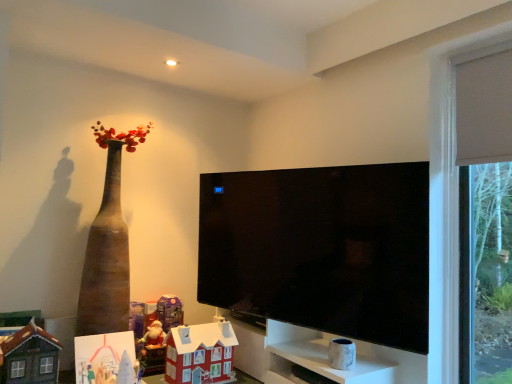
Where is `black glossy tv at center`? This screenshot has width=512, height=384. black glossy tv at center is located at coordinates (321, 249).

What do you see at coordinates (200, 354) in the screenshot?
I see `cardboard house at center, positioned as the second toy in right-to-left order` at bounding box center [200, 354].

Identify the location of white marble vase at lower center, which is counted as the 6th toy, starting from the left. (342, 354).

The width and height of the screenshot is (512, 384). In order to click on window above the matte purple toy at lower center, which is counted as the third toy, starting from the right (from the image's perspective) in this screenshot , I will do `click(448, 195)`.

Is point (435, 62) closer or farther from the camera than point (175, 301)?

Point (435, 62).

From the image's perspective, is matte white curtain at right over matte purple toy at lower center, the fourth toy in the left-to-right sequence?

Correct, matte white curtain at right appears higher than matte purple toy at lower center, the fourth toy in the left-to-right sequence, in the image.

Which is correct: white marble vase at lower center, which ranks as the first toy in right-to-left order, is inside matte brown house at lower left, the 1th toy in the left-to-right sequence, or outside of it?

white marble vase at lower center, which ranks as the first toy in right-to-left order, cannot be found inside matte brown house at lower left, the 1th toy in the left-to-right sequence.

Considering the sizes of objects white marble vase at lower center, which ranks as the first toy in right-to-left order, and matte brown house at lower left, the 1th toy in the left-to-right sequence, in the image provided, who is thinner, white marble vase at lower center, which ranks as the first toy in right-to-left order, or matte brown house at lower left, the 1th toy in the left-to-right sequence,?

white marble vase at lower center, which ranks as the first toy in right-to-left order.

In the image, is white marble vase at lower center, which ranks as the first toy in right-to-left order, on the left side or the right side of matte brown house at lower left, the 1th toy in the left-to-right sequence?

Clearly, white marble vase at lower center, which ranks as the first toy in right-to-left order, is on the right of matte brown house at lower left, the 1th toy in the left-to-right sequence, in the image.

Is white marble vase at lower center, which ranks as the first toy in right-to-left order, next to matte brown house at lower left, the 1th toy in the left-to-right sequence?

No, white marble vase at lower center, which ranks as the first toy in right-to-left order, is not touching matte brown house at lower left, the 1th toy in the left-to-right sequence.

Looking at this image, would you say matte white curtain at right is part of matte brown house at lower left, the 1th toy in the left-to-right sequence,'s contents?

That's incorrect, matte white curtain at right is not inside matte brown house at lower left, the 1th toy in the left-to-right sequence.

Is matte brown house at lower left, the sixth toy in the right-to-left sequence, at the right side of matte white curtain at right?

No.

Does matte brown house at lower left, the 1th toy in the left-to-right sequence, turn towards matte white curtain at right?

No, matte brown house at lower left, the 1th toy in the left-to-right sequence, is not oriented towards matte white curtain at right.

Which is closer to the camera, (150, 335) or (351, 353)?

Clearly, point (150, 335) is more distant from the camera than point (351, 353).

Is matte plastic santa at lower left, which is counted as the 3th toy, starting from the left, positioned far away from white marble vase at lower center, which ranks as the first toy in right-to-left order?

Yes.

Between matte plastic santa at lower left, positioned as the 4th toy in right-to-left order, and white marble vase at lower center, which ranks as the first toy in right-to-left order, which one has larger size?

With larger size is matte plastic santa at lower left, positioned as the 4th toy in right-to-left order.

How different are the orientations of matte plastic santa at lower left, positioned as the 4th toy in right-to-left order, and white marble vase at lower center, which ranks as the first toy in right-to-left order, in degrees?

85.9 degrees separate the facing orientations of matte plastic santa at lower left, positioned as the 4th toy in right-to-left order, and white marble vase at lower center, which ranks as the first toy in right-to-left order.

From a real-world perspective, is matte purple toy at lower center, the fourth toy in the left-to-right sequence, located beneath white marble cabinet at lower right?

Incorrect, from a real-world perspective, matte purple toy at lower center, the fourth toy in the left-to-right sequence, is higher than white marble cabinet at lower right.

Considering the sizes of matte purple toy at lower center, the fourth toy in the left-to-right sequence, and white marble cabinet at lower right in the image, is matte purple toy at lower center, the fourth toy in the left-to-right sequence, taller or shorter than white marble cabinet at lower right?

In the image, matte purple toy at lower center, the fourth toy in the left-to-right sequence, appears to be taller than white marble cabinet at lower right.

Which is correct: matte purple toy at lower center, which is counted as the third toy, starting from the right, is inside white marble cabinet at lower right, or outside of it?

matte purple toy at lower center, which is counted as the third toy, starting from the right, is spatially situated outside white marble cabinet at lower right.

Considering the positions of objects matte purple toy at lower center, which is counted as the third toy, starting from the right, and white marble cabinet at lower right in the image provided, who is behind, matte purple toy at lower center, which is counted as the third toy, starting from the right, or white marble cabinet at lower right?

matte purple toy at lower center, which is counted as the third toy, starting from the right, is further away from the camera.

Is matte white curtain at right aimed at matte brown house at lower left, the 1th toy in the left-to-right sequence?

No, matte white curtain at right does not turn towards matte brown house at lower left, the 1th toy in the left-to-right sequence.

Consider the image. Would you say matte white curtain at right is to the left or to the right of matte brown house at lower left, the sixth toy in the right-to-left sequence, in the picture?

Based on their positions, matte white curtain at right is located to the right of matte brown house at lower left, the sixth toy in the right-to-left sequence.

Is matte white curtain at right positioned beyond the bounds of matte brown house at lower left, the 1th toy in the left-to-right sequence?

Yes, matte white curtain at right is outside of matte brown house at lower left, the 1th toy in the left-to-right sequence.

Looking at their sizes, would you say matte white curtain at right is wider or thinner than matte brown house at lower left, the 1th toy in the left-to-right sequence?

Considering their sizes, matte white curtain at right looks slimmer than matte brown house at lower left, the 1th toy in the left-to-right sequence.

Which toy is the 5th one when counting from the left side of the white marble cabinet at lower right? Please provide its 2D coordinates.

[(30, 357)]

Does matte brown house at lower left, the sixth toy in the right-to-left sequence, have a greater height compared to white marble cabinet at lower right?

Yes, matte brown house at lower left, the sixth toy in the right-to-left sequence, is taller than white marble cabinet at lower right.

How distant is matte brown house at lower left, the 1th toy in the left-to-right sequence, from white marble cabinet at lower right?

The distance of matte brown house at lower left, the 1th toy in the left-to-right sequence, from white marble cabinet at lower right is 4.11 feet.

Can you confirm if matte brown house at lower left, the sixth toy in the right-to-left sequence, is thinner than white marble cabinet at lower right?

Indeed, matte brown house at lower left, the sixth toy in the right-to-left sequence, has a lesser width compared to white marble cabinet at lower right.

Find the location of `toy that is the 5th one when counting backward from the matte white curtain at right`. toy that is the 5th one when counting backward from the matte white curtain at right is located at coordinates (169, 312).

The image size is (512, 384). I want to click on the 5th toy counting from the left of the white marble vase at lower center, which ranks as the first toy in right-to-left order, so click(30, 357).

Estimate the real-world distances between objects in this image. Which object is further from black glossy tv at center, matte white curtain at right or matte white paper at lower left, the fifth toy when ordered from right to left?

Among the two, matte white paper at lower left, the fifth toy when ordered from right to left, is located further to black glossy tv at center.

When comparing their distances from matte plastic santa at lower left, positioned as the 4th toy in right-to-left order, does white marble vase at lower center, which ranks as the first toy in right-to-left order, or matte white curtain at right seem closer?

Based on the image, white marble vase at lower center, which ranks as the first toy in right-to-left order, appears to be nearer to matte plastic santa at lower left, positioned as the 4th toy in right-to-left order.

Consider the image. From the image, which object appears to be nearer to matte brown house at lower left, the 1th toy in the left-to-right sequence, white marble cabinet at lower right or cardboard house at center, arranged as the fifth toy when viewed from the left?

The object closer to matte brown house at lower left, the 1th toy in the left-to-right sequence, is cardboard house at center, arranged as the fifth toy when viewed from the left.

Estimate the real-world distances between objects in this image. Which object is further from matte plastic santa at lower left, positioned as the 4th toy in right-to-left order, matte white paper at lower left, placed as the 2th toy when sorted from left to right, or matte white curtain at right?

The object further to matte plastic santa at lower left, positioned as the 4th toy in right-to-left order, is matte white curtain at right.

When comparing their distances from matte white paper at lower left, the fifth toy when ordered from right to left, does black glossy tv at center or matte white curtain at right seem closer?

Based on the image, black glossy tv at center appears to be nearer to matte white paper at lower left, the fifth toy when ordered from right to left.

Estimate the real-world distances between objects in this image. Which object is further from matte white paper at lower left, the fifth toy when ordered from right to left, black glossy tv at center or matte purple toy at lower center, which is counted as the third toy, starting from the right?

black glossy tv at center lies further to matte white paper at lower left, the fifth toy when ordered from right to left, than the other object.

When comparing their distances from white marble cabinet at lower right, does matte plastic santa at lower left, which is counted as the 3th toy, starting from the left, or black glossy tv at center seem closer?

Based on the image, black glossy tv at center appears to be nearer to white marble cabinet at lower right.

Which object lies further to the anchor point white marble cabinet at lower right, matte white paper at lower left, placed as the 2th toy when sorted from left to right, or cardboard house at center, arranged as the fifth toy when viewed from the left?

matte white paper at lower left, placed as the 2th toy when sorted from left to right, is positioned further to the anchor white marble cabinet at lower right.

I want to click on television between matte purple toy at lower center, which is counted as the third toy, starting from the right, and white marble vase at lower center, which ranks as the first toy in right-to-left order, so click(x=321, y=249).

You are a GUI agent. You are given a task and a screenshot of the screen. Output one action in this format:
    pyautogui.click(x=<x>, y=<y>)
    Task: Click on the toy between matte purple toy at lower center, which is counted as the third toy, starting from the right, and white marble cabinet at lower right, in the horizontal direction
    This screenshot has height=384, width=512.
    Given the screenshot: What is the action you would take?
    pyautogui.click(x=200, y=354)

Image resolution: width=512 pixels, height=384 pixels. I want to click on cabinet between matte white paper at lower left, placed as the 2th toy when sorted from left to right, and matte white curtain at right, in the horizontal direction, so click(316, 357).

Where is `television between matte white paper at lower left, placed as the 2th toy when sorted from left to right, and matte white curtain at right from left to right`? The height and width of the screenshot is (384, 512). television between matte white paper at lower left, placed as the 2th toy when sorted from left to right, and matte white curtain at right from left to right is located at coordinates (321, 249).